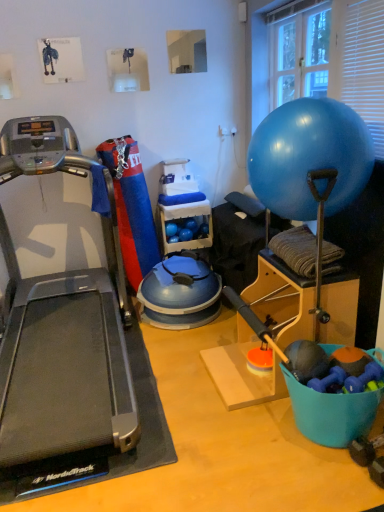
Question: Can you confirm if transparent glass window at upper right is positioned to the right of blue plastic bucket at lower right?

Choices:
 (A) no
 (B) yes

Answer: (B)

Question: Is transparent glass window at upper right bigger than blue plastic bucket at lower right?

Choices:
 (A) no
 (B) yes

Answer: (B)

Question: Can you confirm if transparent glass window at upper right is positioned to the left of blue plastic bucket at lower right?

Choices:
 (A) no
 (B) yes

Answer: (A)

Question: Considering the relative sizes of transparent glass window at upper right and blue plastic bucket at lower right in the image provided, is transparent glass window at upper right shorter than blue plastic bucket at lower right?

Choices:
 (A) no
 (B) yes

Answer: (A)

Question: Does transparent glass window at upper right have a greater width compared to blue plastic bucket at lower right?

Choices:
 (A) no
 (B) yes

Answer: (A)

Question: In terms of height, does blue plastic bucket at lower right look taller or shorter compared to blue rubber ball at upper right?

Choices:
 (A) tall
 (B) short

Answer: (B)

Question: Considering the positions of point (307, 423) and point (304, 112), is point (307, 423) closer or farther from the camera than point (304, 112)?

Choices:
 (A) farther
 (B) closer

Answer: (A)

Question: Is blue plastic bucket at lower right bigger or smaller than blue rubber ball at upper right?

Choices:
 (A) small
 (B) big

Answer: (A)

Question: Is blue plastic bucket at lower right inside the boundaries of blue rubber ball at upper right, or outside?

Choices:
 (A) inside
 (B) outside

Answer: (B)

Question: Is blue rubber ball at upper right bigger or smaller than blue plastic bucket at lower right?

Choices:
 (A) small
 (B) big

Answer: (B)

Question: Looking at their shapes, would you say blue rubber ball at upper right is wider or thinner than blue plastic bucket at lower right?

Choices:
 (A) wide
 (B) thin

Answer: (A)

Question: Is point (263, 176) positioned closer to the camera than point (354, 428)?

Choices:
 (A) closer
 (B) farther

Answer: (B)

Question: From the image's perspective, is blue rubber ball at upper right positioned above or below blue plastic bucket at lower right?

Choices:
 (A) below
 (B) above

Answer: (B)

Question: Considering the positions of blue plastic bucket at lower right and silver/black treadmill at left in the image, is blue plastic bucket at lower right taller or shorter than silver/black treadmill at left?

Choices:
 (A) short
 (B) tall

Answer: (A)

Question: Is blue plastic bucket at lower right in front of or behind silver/black treadmill at left in the image?

Choices:
 (A) behind
 (B) front

Answer: (A)